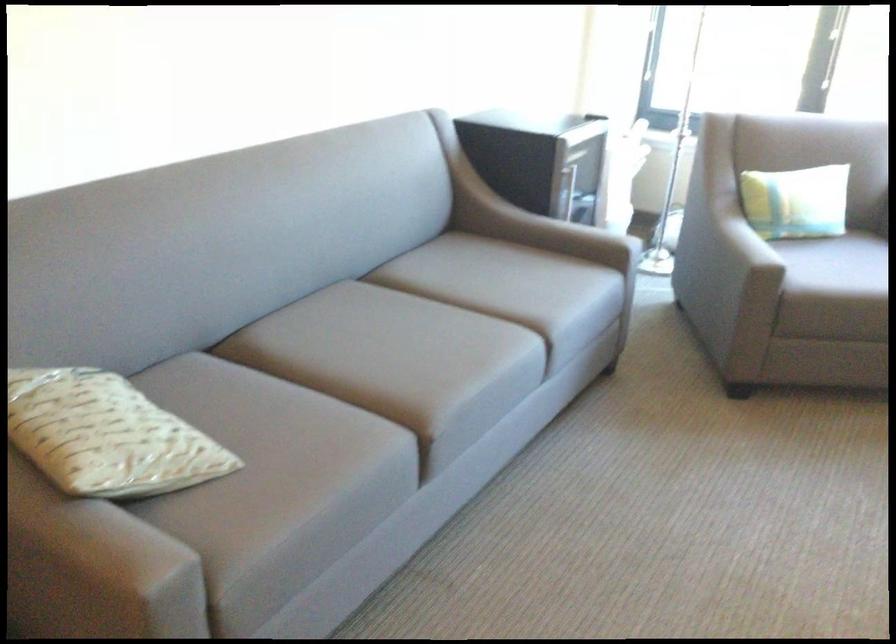
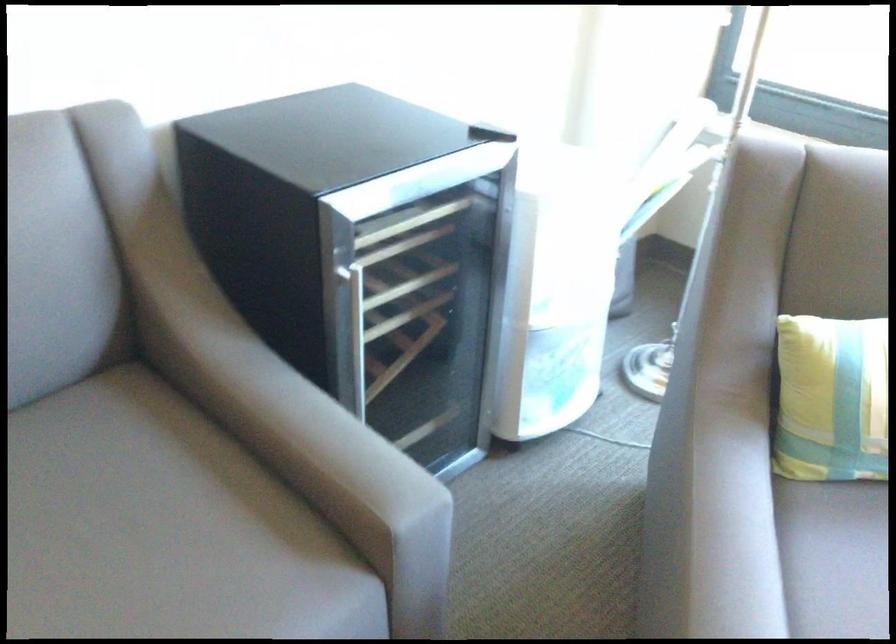
In the second image, find the point that corresponds to pixel 743 251 in the first image.

(837, 553)